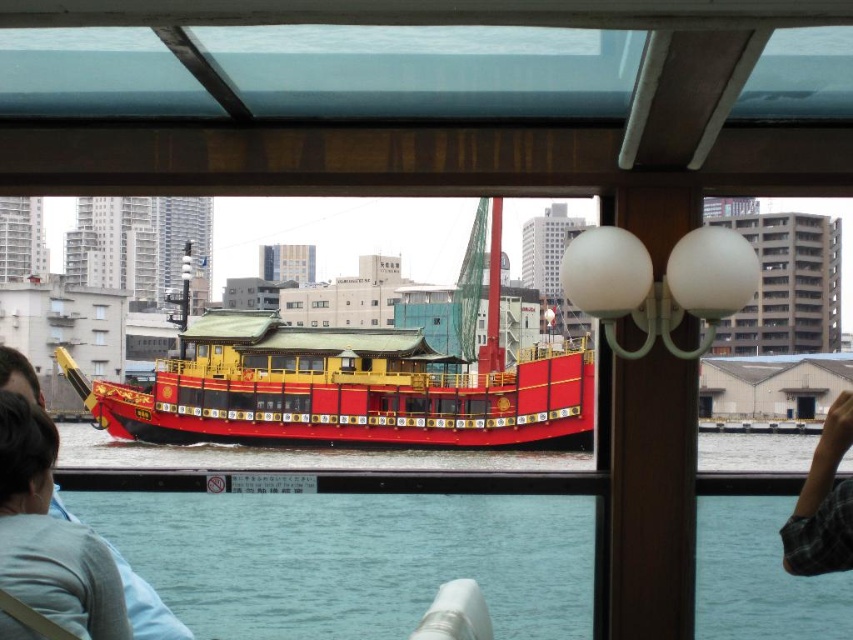
Does shiny red boat at center have a greater width compared to light blue shirt at lower left?

Indeed, shiny red boat at center has a greater width compared to light blue shirt at lower left.

Is shiny red boat at center shorter than light blue shirt at lower left?

No, shiny red boat at center is not shorter than light blue shirt at lower left.

Measure the distance between shiny red boat at center and camera.

shiny red boat at center and camera are 95.57 meters apart.

Where is `shiny red boat at center`? shiny red boat at center is located at coordinates (364, 368).

How much distance is there between clear water at lower center and transparent glass window at center?

They are 128.70 meters apart.

Which is in front, point (743, 588) or point (96, 314)?

Point (743, 588) is more forward.

This screenshot has height=640, width=853. In order to click on clear water at lower center in this screenshot , I will do `click(352, 560)`.

Is clear water at lower center thinner than shiny red boat at center?

Yes, clear water at lower center is thinner than shiny red boat at center.

Between point (154, 525) and point (279, 396), which one is positioned behind?

The point (279, 396) is more distant.

Image resolution: width=853 pixels, height=640 pixels. Find the location of `clear water at lower center`. clear water at lower center is located at coordinates (352, 560).